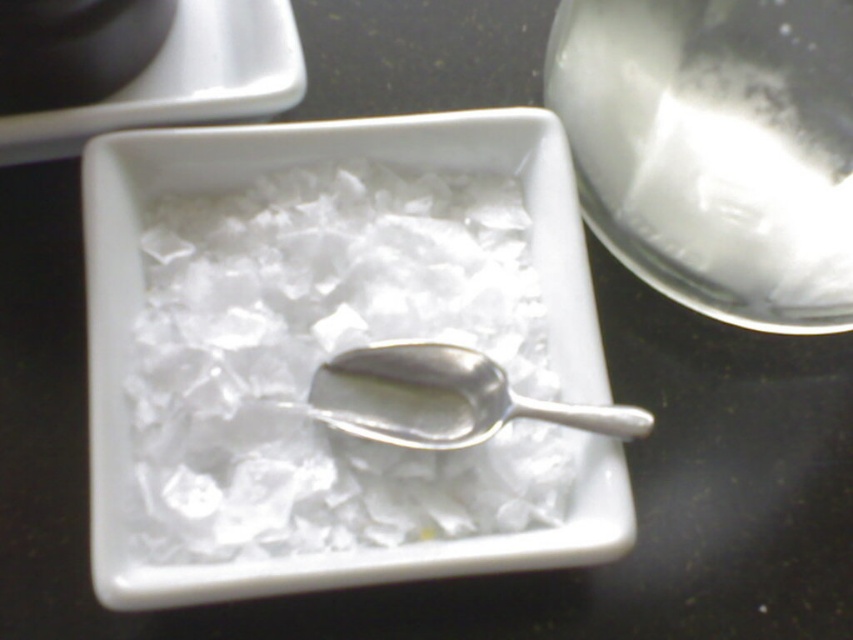
Based on the photo, does clear ice cubes at center have a lesser height compared to transparent glass bowl at upper right?

No.

I want to click on clear ice cubes at center, so [x=329, y=355].

You are a GUI agent. You are given a task and a screenshot of the screen. Output one action in this format:
    pyautogui.click(x=<x>, y=<y>)
    Task: Click on the clear ice cubes at center
    Image resolution: width=853 pixels, height=640 pixels.
    Given the screenshot: What is the action you would take?
    (329, 355)

Is clear ice cubes at center bigger than silver metallic spoon at center?

Correct, clear ice cubes at center is larger in size than silver metallic spoon at center.

Can you confirm if clear ice cubes at center is positioned below silver metallic spoon at center?

No, clear ice cubes at center is not below silver metallic spoon at center.

Between point (444, 468) and point (425, 416), which one is positioned behind?

Point (425, 416)

You are a GUI agent. You are given a task and a screenshot of the screen. Output one action in this format:
    pyautogui.click(x=<x>, y=<y>)
    Task: Click on the clear ice cubes at center
    The height and width of the screenshot is (640, 853).
    Given the screenshot: What is the action you would take?
    pyautogui.click(x=329, y=355)

Does point (770, 304) lie in front of point (381, 376)?

No.

Which is in front, point (793, 156) or point (498, 428)?

Point (793, 156)

Where is `transparent glass bowl at upper right`? transparent glass bowl at upper right is located at coordinates (715, 148).